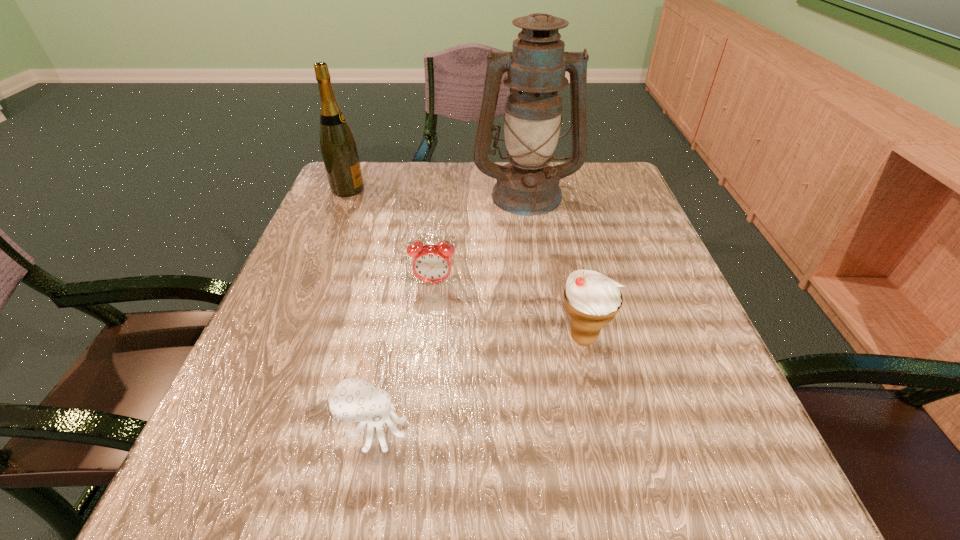
At what (x,y) coordinates should I click in order to perform the action: click on unoccupied area between the third farthest object and the octopus. Please return your answer as a coordinate pair (x, y). Looking at the image, I should click on (404, 356).

Where is `empty location between the oil lamp and the wine bottle`? Image resolution: width=960 pixels, height=540 pixels. empty location between the oil lamp and the wine bottle is located at coordinates (437, 192).

Where is `empty location between the third farthest object and the wine bottle`? This screenshot has height=540, width=960. empty location between the third farthest object and the wine bottle is located at coordinates pos(391,236).

I want to click on free space between the leftmost object and the third farthest object, so click(x=391, y=236).

This screenshot has width=960, height=540. Identify the location of vacant area between the alarm clock and the nearest object. (404, 356).

What are the coordinates of `blank region between the wine bottle and the icecream` in the screenshot? It's located at (466, 264).

Find the location of a particular element. This screenshot has height=540, width=960. the fourth closest object to the third shortest object is located at coordinates (338, 147).

The width and height of the screenshot is (960, 540). I want to click on object that is the second closest to the wine bottle, so pos(431,263).

Where is `free location that satisfies the following two spatial constraints: 1. on the front-facing side of the wine bottle; 2. on the left side of the icecream`? The width and height of the screenshot is (960, 540). free location that satisfies the following two spatial constraints: 1. on the front-facing side of the wine bottle; 2. on the left side of the icecream is located at coordinates click(285, 338).

This screenshot has width=960, height=540. Identify the location of vacant position in the image that satisfies the following two spatial constraints: 1. on the front side of the third tallest object; 2. on the front-facing side of the nearest object. (604, 429).